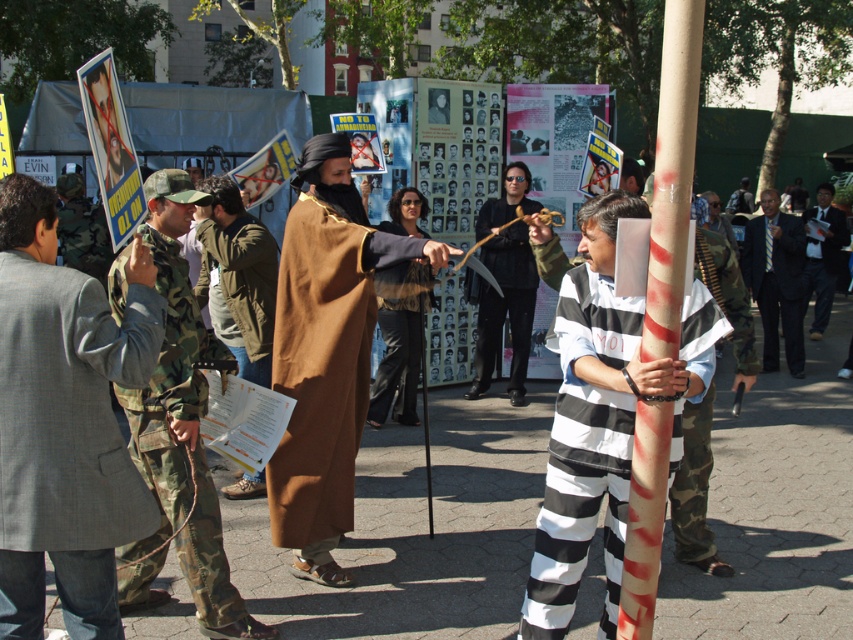
Question: Which object appears closest to the camera in this image?

Choices:
 (A) striped cotton shirt at center
 (B) brown suede robe at center
 (C) brown suede jacket at center
 (D) brown cotton robe at center

Answer: (A)

Question: Based on their relative distances, which object is nearer to the black matte scythe at center?

Choices:
 (A) dark suit at right
 (B) brown cotton robe at center

Answer: (B)

Question: Estimate the real-world distances between objects in this image. Which object is closer to the dark suit at right?

Choices:
 (A) blue striped suit at center
 (B) black matte scythe at center
 (C) brown cotton robe at center
 (D) camouflage fabric uniform at left

Answer: (A)

Question: Is camouflage fabric uniform at left wider than brown suede robe at center?

Choices:
 (A) no
 (B) yes

Answer: (B)

Question: Where is striped cotton shirt at center located in relation to brown cotton robe at center in the image?

Choices:
 (A) below
 (B) above

Answer: (A)

Question: Is black matte scythe at center positioned behind blue striped suit at center?

Choices:
 (A) no
 (B) yes

Answer: (A)